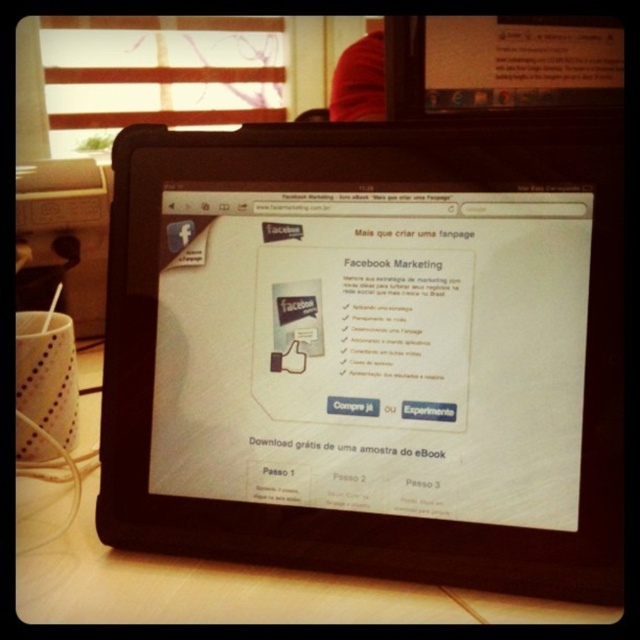
Locate an element on the screen. black matte tablet at center is located at coordinates [362, 340].

Is black matte tablet at center to the right of wooden table at lower center from the viewer's perspective?

Yes, black matte tablet at center is to the right of wooden table at lower center.

Which is in front, point (144, 396) or point (86, 481)?

Point (144, 396) is in front.

Where is `black matte tablet at center`? black matte tablet at center is located at coordinates (362, 340).